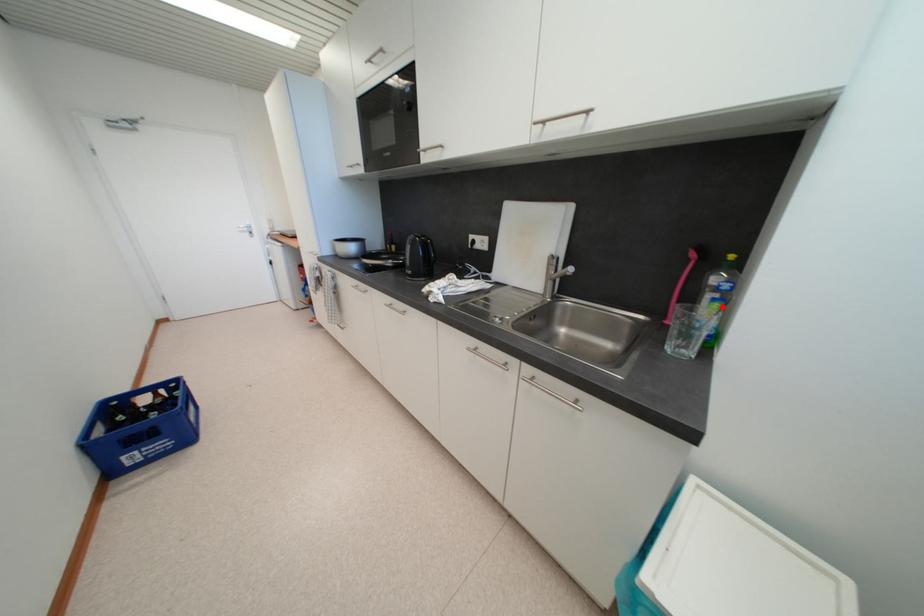
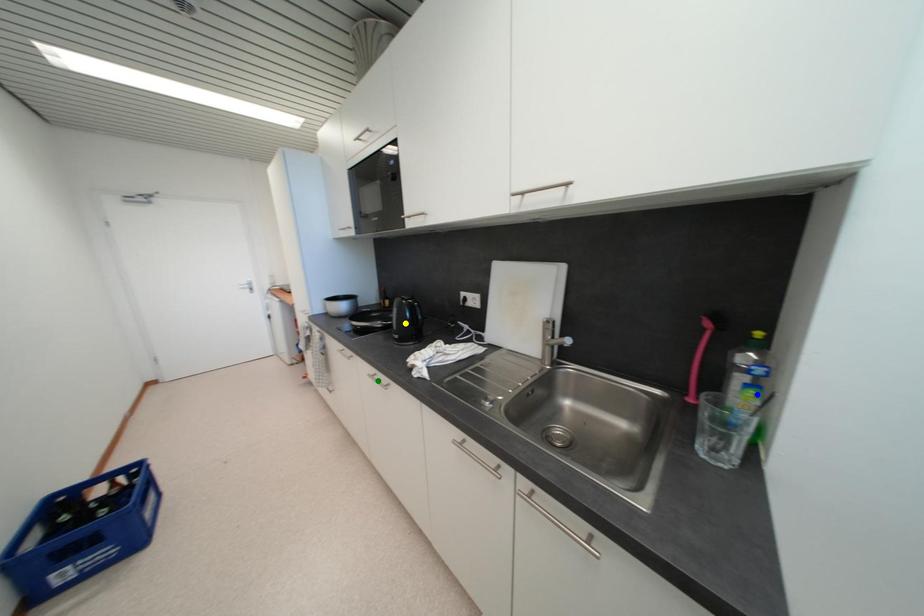
Question: I am providing you with two images of the same scene from different viewpoints. A red point is marked on the first image. You are given multiple points on the second image. Can you choose the point in image 2 that corresponds to the point in image 1?

Choices:
 (A) yellow point
 (B) blue point
 (C) green point

Answer: (B)